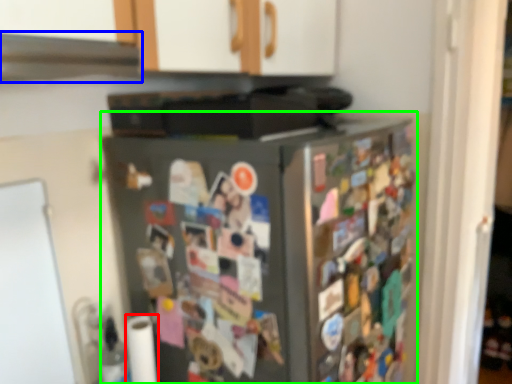
Question: Which is nearer to the toilet paper (highlighted by a red box)? exhaust hood (highlighted by a blue box) or refrigerator (highlighted by a green box).

Choices:
 (A) exhaust hood
 (B) refrigerator

Answer: (B)